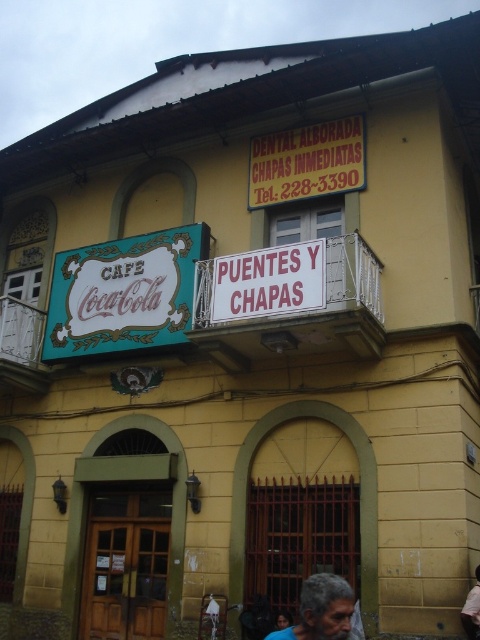
You are a customer looking for the dental office. You see a yellow plastic sign at upper center and a gray hair at lower center. Which one is higher up?

The yellow plastic sign at upper center is higher up than the gray hair at lower center.

You are a customer looking for the dental office. You see the teal glossy signboard at upper left and the white painted wood at upper left. Which one is located above the other?

The teal glossy signboard at upper left is positioned over the white painted wood at upper left.